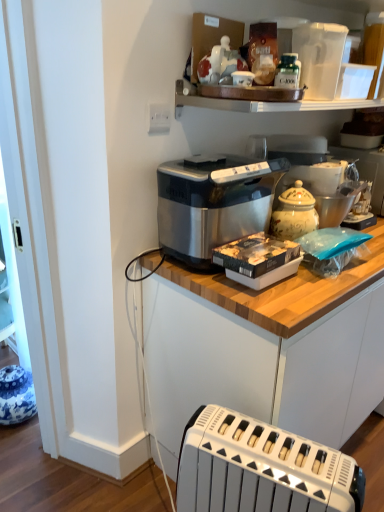
Question: Should I look upward or downward to see satin metallic bread maker at center?

Choices:
 (A) down
 (B) up

Answer: (B)

Question: Should I look upward or downward to see blue and white ceramic vase at lower left, acting as the third appliance starting from the top?

Choices:
 (A) up
 (B) down

Answer: (B)

Question: Does white ceramic jar at upper right, the 2th appliance in the bottom-to-top sequence, have a larger size compared to satin silver toaster at center?

Choices:
 (A) yes
 (B) no

Answer: (B)

Question: Is white ceramic jar at upper right, the 2th appliance viewed from the top, looking in the opposite direction of satin silver toaster at center?

Choices:
 (A) no
 (B) yes

Answer: (A)

Question: From a real-world perspective, is white ceramic jar at upper right, the 2th appliance viewed from the top, over satin silver toaster at center?

Choices:
 (A) yes
 (B) no

Answer: (A)

Question: Would you say white ceramic jar at upper right, the 2th appliance viewed from the top, contains satin silver toaster at center?

Choices:
 (A) no
 (B) yes

Answer: (A)

Question: Does white ceramic jar at upper right, the 2th appliance in the bottom-to-top sequence, turn towards satin silver toaster at center?

Choices:
 (A) no
 (B) yes

Answer: (A)

Question: Does white ceramic jar at upper right, which is counted as the first appliance, starting from the right, have a smaller size compared to satin silver toaster at center?

Choices:
 (A) yes
 (B) no

Answer: (A)

Question: Does white plastic toaster at lower center have a greater height compared to blue and white ceramic vase at lower left, the first appliance when ordered from left to right?

Choices:
 (A) yes
 (B) no

Answer: (A)

Question: Considering the relative positions of white plastic toaster at lower center and blue and white ceramic vase at lower left, the first appliance when ordered from left to right, in the image provided, is white plastic toaster at lower center to the left of blue and white ceramic vase at lower left, the first appliance when ordered from left to right, from the viewer's perspective?

Choices:
 (A) no
 (B) yes

Answer: (A)

Question: Would you say blue and white ceramic vase at lower left, the first appliance when ordered from left to right, is part of white plastic toaster at lower center's contents?

Choices:
 (A) yes
 (B) no

Answer: (B)

Question: Is white plastic toaster at lower center completely or partially outside of blue and white ceramic vase at lower left, acting as the third appliance starting from the right?

Choices:
 (A) no
 (B) yes

Answer: (B)

Question: From a real-world perspective, is white plastic toaster at lower center under blue and white ceramic vase at lower left, acting as the third appliance starting from the right?

Choices:
 (A) yes
 (B) no

Answer: (B)

Question: Can you confirm if white plastic toaster at lower center is shorter than blue and white ceramic vase at lower left, the first appliance when ordered from left to right?

Choices:
 (A) yes
 (B) no

Answer: (B)

Question: Does satin silver toaster at center turn towards green glass bottle at upper center?

Choices:
 (A) no
 (B) yes

Answer: (A)